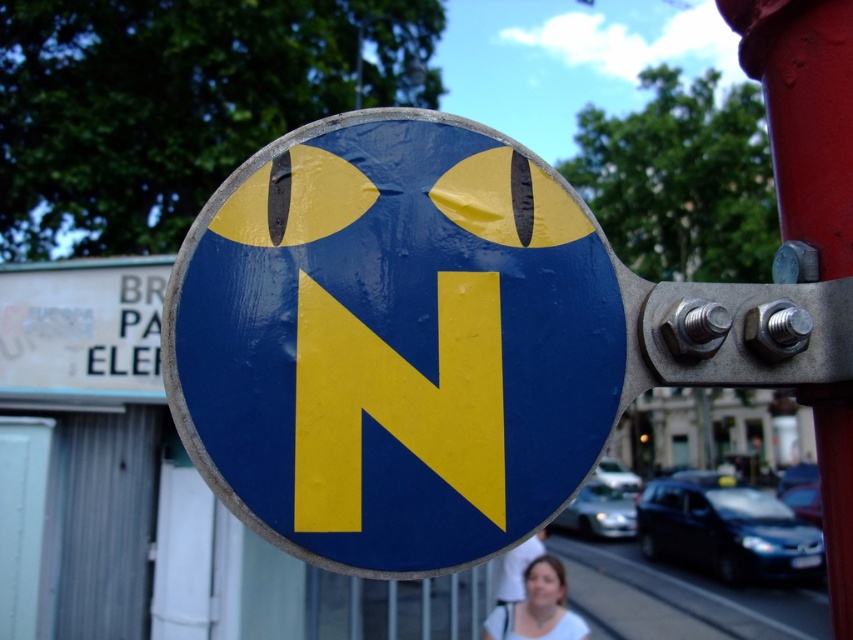
Question: Which of the following is the farthest from the observer?

Choices:
 (A) (234, 349)
 (B) (352, 480)
 (C) (746, 16)

Answer: (C)

Question: Is yellow matte sign at center wider than metallic red pole at right?

Choices:
 (A) no
 (B) yes

Answer: (A)

Question: Which of the following is the closest to the observer?

Choices:
 (A) metallic red pole at right
 (B) smooth white blouse at lower center
 (C) matte blue sign at center
 (D) yellow matte sign at center

Answer: (C)

Question: Is matte blue sign at center bigger than smooth white blouse at lower center?

Choices:
 (A) yes
 (B) no

Answer: (B)

Question: Which of these objects is positioned farthest from the matte blue sign at center?

Choices:
 (A) yellow matte sign at center
 (B) smooth white blouse at lower center
 (C) metallic red pole at right

Answer: (B)

Question: Is yellow matte sign at center wider than metallic red pole at right?

Choices:
 (A) no
 (B) yes

Answer: (A)